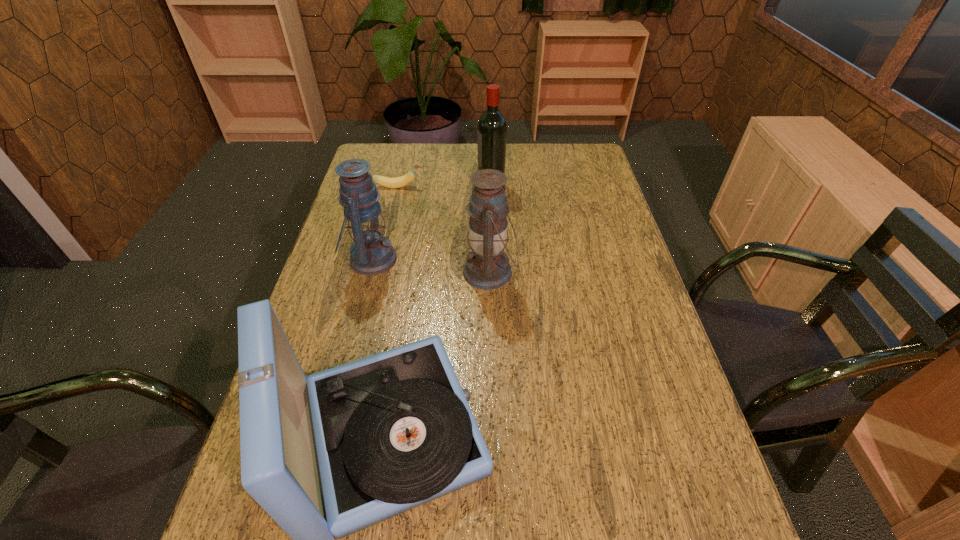
Identify the location of lantern that is positioned at the left edge. Image resolution: width=960 pixels, height=540 pixels. (371, 253).

This screenshot has width=960, height=540. What are the coordinates of `banana located at the left edge` in the screenshot? It's located at pyautogui.click(x=402, y=181).

You are a GUI agent. You are given a task and a screenshot of the screen. Output one action in this format:
    pyautogui.click(x=<x>, y=<y>)
    Task: Click on the free space at the far edge of the desktop
    
    Given the screenshot: What is the action you would take?
    pyautogui.click(x=419, y=176)

Find the location of a particular element. This screenshot has height=540, width=960. vacant space at the left edge of the desktop is located at coordinates (326, 363).

The image size is (960, 540). In order to click on vacant space at the right edge in this screenshot , I will do `click(619, 232)`.

I want to click on blank space at the far right corner, so click(x=570, y=150).

This screenshot has width=960, height=540. Identify the location of free space between the lantern and the oil lamp. (430, 266).

This screenshot has width=960, height=540. Find the location of `vacant region between the lantern and the wine bottle`. vacant region between the lantern and the wine bottle is located at coordinates (431, 223).

You are a GUI agent. You are given a task and a screenshot of the screen. Output one action in this format:
    pyautogui.click(x=<x>, y=<y>)
    Task: Click on the second closest object to the shortest object
    This screenshot has width=960, height=540.
    Given the screenshot: What is the action you would take?
    pyautogui.click(x=371, y=253)

Identify the location of object that stands as the fourth closest to the lantern. (492, 129).